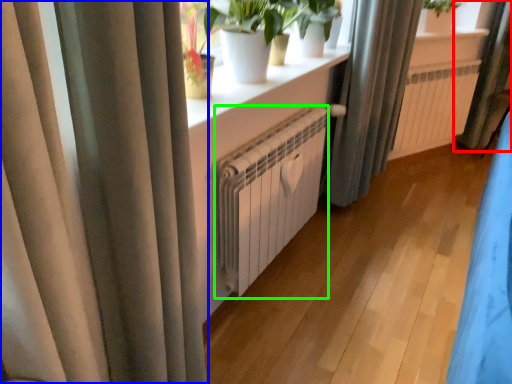
Question: Based on their relative distances, which object is nearer to curtain (highlighted by a red box)? Choose from curtain (highlighted by a blue box) and radiator (highlighted by a green box).

Choices:
 (A) curtain
 (B) radiator

Answer: (B)